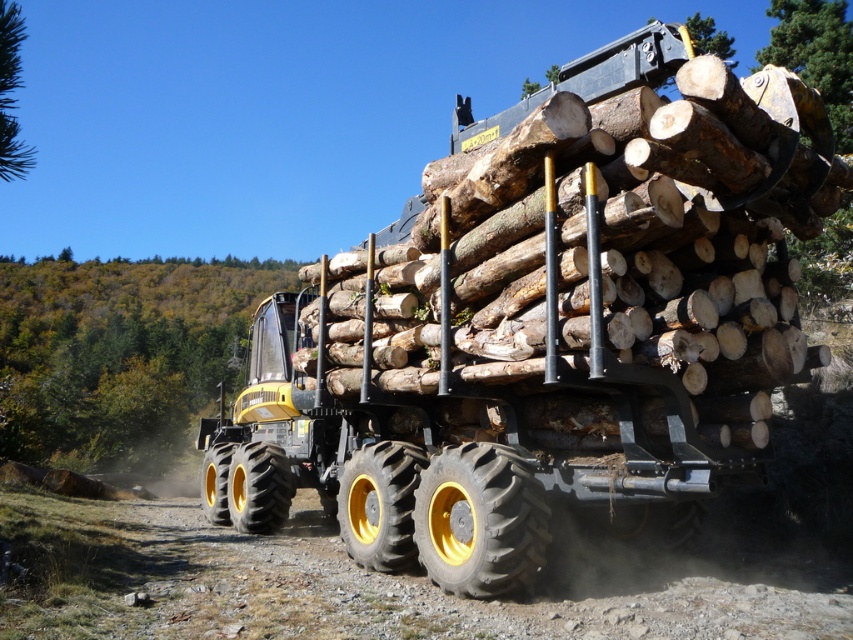
Question: Which is nearer to the dusty gravel dirt track at lower center?

Choices:
 (A) yellow rubber tire at center
 (B) green rough bark tree at upper center
 (C) rubber/rough tire at lower left
 (D) yellow metallic tractor at center

Answer: (C)

Question: Which point appears closest to the camera in this image?

Choices:
 (A) (235, 474)
 (B) (206, 513)
 (C) (694, 48)
 (D) (706, 573)

Answer: (C)

Question: Is rubber/yellow rimmed tire at lower center smaller than green rough bark tree at upper center?

Choices:
 (A) yes
 (B) no

Answer: (A)

Question: Based on their relative distances, which object is farther from the rubber/rough tire at lower left?

Choices:
 (A) green rough bark tree at upper center
 (B) yellow rubber tire at lower center

Answer: (A)

Question: Observing the image, what is the correct spatial positioning of dusty gravel dirt track at lower center in reference to green leafy tree at upper left?

Choices:
 (A) below
 (B) above

Answer: (A)

Question: From the image, what is the correct spatial relationship of matte black trailer truck at center in relation to green rough bark tree at upper center?

Choices:
 (A) above
 (B) below

Answer: (B)